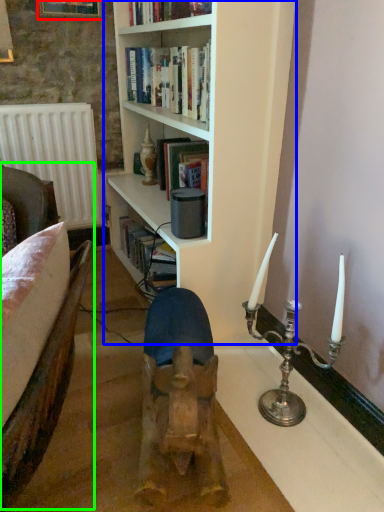
Question: Estimate the real-world distances between objects in this image. Which object is farther from picture frame (highlighted by a red box), bookcase (highlighted by a blue box) or armchair (highlighted by a green box)?

Choices:
 (A) bookcase
 (B) armchair

Answer: (B)